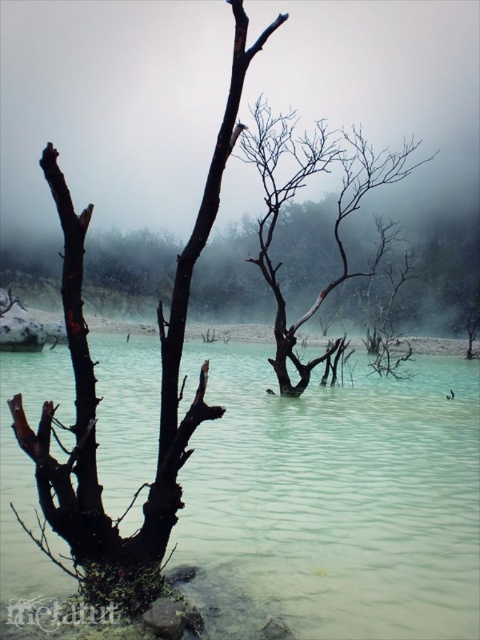
Question: In this image, where is green translucent water at center located relative to charcoal matte tree at center?

Choices:
 (A) above
 (B) below

Answer: (B)

Question: Which point is farther to the camera?

Choices:
 (A) (308, 522)
 (B) (277, 294)

Answer: (B)

Question: Considering the real-world distances, which object is closest to the charcoal matte tree at center?

Choices:
 (A) green translucent water at center
 (B) dark brown bark tree at left

Answer: (A)

Question: Where is dark brown bark tree at left located in relation to charcoal matte tree at center in the image?

Choices:
 (A) right
 (B) left

Answer: (B)

Question: Can you confirm if dark brown bark tree at left is positioned to the right of charcoal matte tree at center?

Choices:
 (A) yes
 (B) no

Answer: (B)

Question: Considering the real-world distances, which object is closest to the green translucent water at center?

Choices:
 (A) charcoal matte tree at center
 (B) dark brown bark tree at left

Answer: (B)